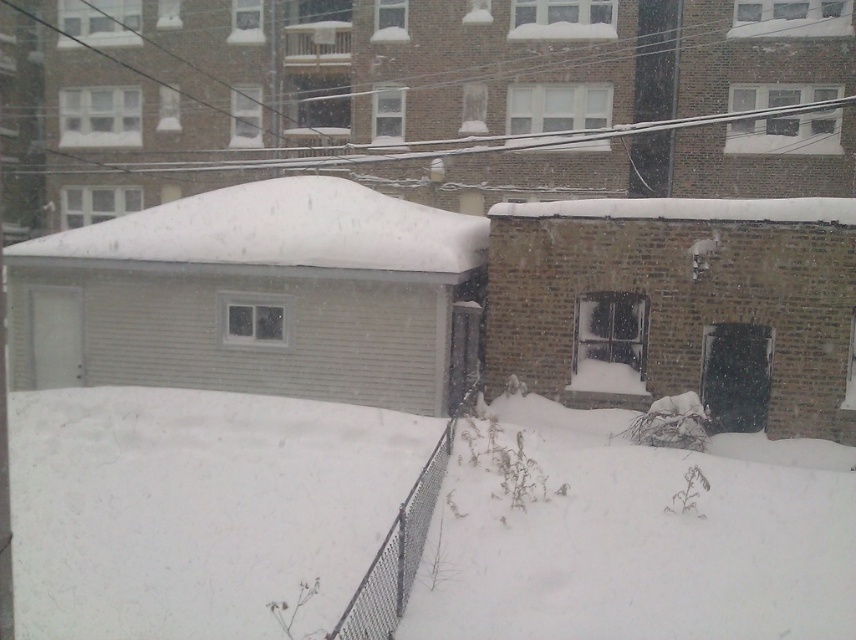
Is white fluffy snow at lower left behind white fluffy snow at center?

No, it is not.

Between white fluffy snow at lower left and white fluffy snow at center, which one is positioned lower?

white fluffy snow at lower left

Is point (346, 540) farther from camera compared to point (150, 221)?

No, it is not.

Find the location of a particular element. The image size is (856, 640). white fluffy snow at lower left is located at coordinates (197, 508).